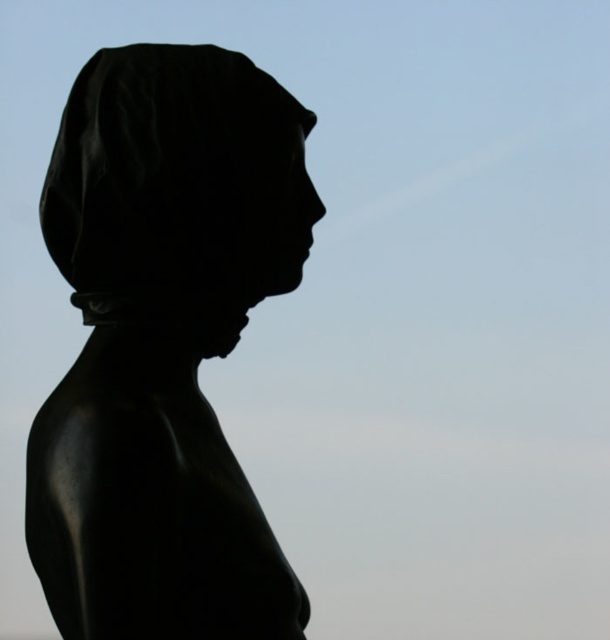
Question: From the image, what is the correct spatial relationship of black polished statue at center in relation to black matte head at center?

Choices:
 (A) above
 (B) below

Answer: (B)

Question: Which point is farther to the camera?

Choices:
 (A) (68, 388)
 (B) (115, 61)

Answer: (B)

Question: Which object appears closest to the camera in this image?

Choices:
 (A) black matte head at center
 (B) black polished statue at center

Answer: (B)

Question: Considering the relative positions of black polished statue at center and black matte head at center in the image provided, where is black polished statue at center located with respect to black matte head at center?

Choices:
 (A) above
 (B) below

Answer: (B)

Question: Is black polished statue at center below black matte head at center?

Choices:
 (A) yes
 (B) no

Answer: (A)